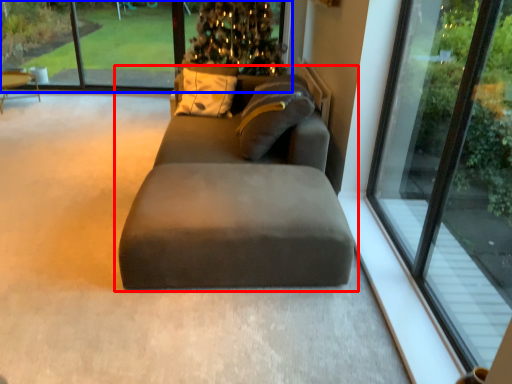
Question: Which of the following is the closest to the observer, studio couch (highlighted by a red box) or window screen (highlighted by a blue box)?

Choices:
 (A) studio couch
 (B) window screen

Answer: (A)